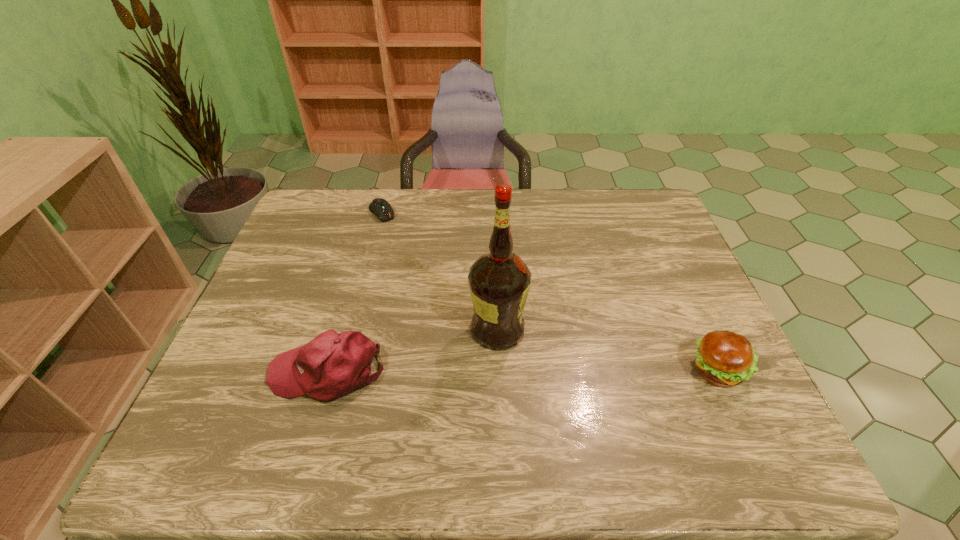
You are a GUI agent. You are given a task and a screenshot of the screen. Output one action in this format:
    pyautogui.click(x=<x>, y=<y>)
    Task: Click on the vacant space on the desktop that is between the baseball cap and the second shortest object and is positioned on the button of the shortest object
    
    Given the screenshot: What is the action you would take?
    pyautogui.click(x=501, y=372)

Where is `vacant space on the desktop that is between the baseball cap and the third tallest object and is positioned on the label of the second object from right to left`? Image resolution: width=960 pixels, height=540 pixels. vacant space on the desktop that is between the baseball cap and the third tallest object and is positioned on the label of the second object from right to left is located at coordinates (576, 372).